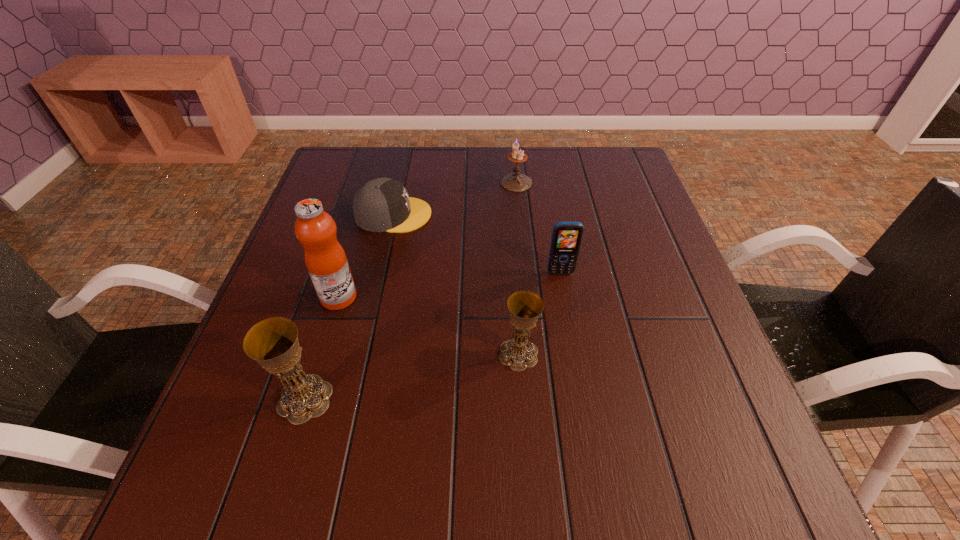
Please show where to add a chalice on the right while keeping spacing even. Please provide its 2D coordinates. Your answer should be formatted as a tuple, i.e. [(x, y)], where the tuple contains the x and y coordinates of a point satisfying the conditions above.

[(702, 316)]